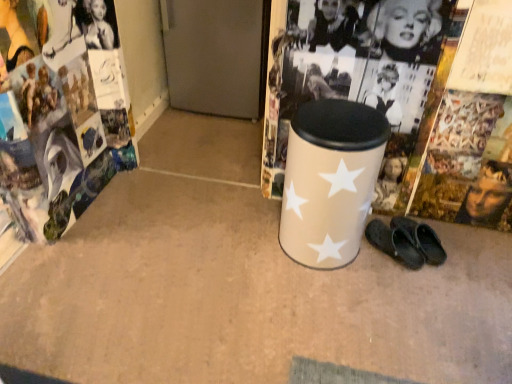
What do you see at coordinates (330, 180) in the screenshot?
I see `beige matte waste container at center` at bounding box center [330, 180].

In order to face beige matte waste container at center, should I rotate leftwards or rightwards?

You should rotate right by 9.753 degrees.

This screenshot has width=512, height=384. Describe the element at coordinates (58, 116) in the screenshot. I see `matte paper magazine at left` at that location.

You are a GUI agent. You are given a task and a screenshot of the screen. Output one action in this format:
    pyautogui.click(x=<x>, y=<y>)
    Task: Click on the beige matte waste container at center
    Image resolution: width=512 pixels, height=384 pixels.
    Given the screenshot: What is the action you would take?
    pyautogui.click(x=330, y=180)

Is matte paper magazine at left turned away from black rubber slippers at lower right?

No, matte paper magazine at left's orientation is not away from black rubber slippers at lower right.

From the image's perspective, is matte paper magazine at left above or below black rubber slippers at lower right?

matte paper magazine at left is above black rubber slippers at lower right.

Is matte paper magazine at left with black rubber slippers at lower right?

No.

Looking at this image, can you tell me how much matte paper magazine at left and black rubber slippers at lower right differ in facing direction?

The facing directions of matte paper magazine at left and black rubber slippers at lower right are 131 degrees apart.

Is beige matte waste container at center bigger than matte paper magazine at left?

Yes, beige matte waste container at center is bigger than matte paper magazine at left.

Is beige matte waste container at center placed right next to matte paper magazine at left?

They are not placed beside each other.

Is beige matte waste container at center not within matte paper magazine at left?

That's correct, beige matte waste container at center is outside of matte paper magazine at left.

From the image's perspective, does beige matte waste container at center appear higher than matte paper magazine at left?

Actually, beige matte waste container at center appears below matte paper magazine at left in the image.

Is black rubber slippers at lower right in contact with beige matte waste container at center?

No, black rubber slippers at lower right is not in contact with beige matte waste container at center.

Is black rubber slippers at lower right shorter than beige matte waste container at center?

Yes.

Is black rubber slippers at lower right positioned beyond the bounds of beige matte waste container at center?

Yes, black rubber slippers at lower right is located beyond the bounds of beige matte waste container at center.

Where is `footwear that is under the beige matte waste container at center (from a real-world perspective)`? footwear that is under the beige matte waste container at center (from a real-world perspective) is located at coordinates (407, 242).

Which is nearer, (68,207) or (316,263)?

Point (316,263)

Find the location of a particular element. This screenshot has height=384, width=512. waste container in front of the matte paper magazine at left is located at coordinates (330, 180).

Is there a large distance between matte paper magazine at left and beige matte waste container at center?

Yes, matte paper magazine at left and beige matte waste container at center are quite far apart.

In terms of width, does matte paper magazine at left look wider or thinner when compared to beige matte waste container at center?

Clearly, matte paper magazine at left has more width compared to beige matte waste container at center.

Is beige matte waste container at center taller or shorter than black rubber slippers at lower right?

Considering their sizes, beige matte waste container at center has more height than black rubber slippers at lower right.

Is point (351, 239) in front of point (411, 223)?

That is True.

Is beige matte waste container at center turned away from black rubber slippers at lower right?

No, beige matte waste container at center is not facing away from black rubber slippers at lower right.

Can you confirm if beige matte waste container at center is positioned to the right of black rubber slippers at lower right?

No.

The image size is (512, 384). I want to click on magazine above the black rubber slippers at lower right (from the image's perspective), so click(58, 116).

Could you tell me if black rubber slippers at lower right is turned towards matte paper magazine at left?

No, black rubber slippers at lower right does not turn towards matte paper magazine at left.

Does black rubber slippers at lower right have a greater height compared to matte paper magazine at left?

Correct, black rubber slippers at lower right is much taller as matte paper magazine at left.

Which object is positioned more to the right, black rubber slippers at lower right or matte paper magazine at left?

black rubber slippers at lower right is more to the right.

Find the location of a particular element. magazine below the black rubber slippers at lower right (from a real-world perspective) is located at coordinates (58, 116).

Where is `magazine lying behind the beige matte waste container at center`? The image size is (512, 384). magazine lying behind the beige matte waste container at center is located at coordinates (58, 116).

Estimate the real-world distances between objects in this image. Which object is further from matte paper magazine at left, black rubber slippers at lower right or beige matte waste container at center?

Based on the image, black rubber slippers at lower right appears to be further to matte paper magazine at left.

From the image, which object appears to be farther from black rubber slippers at lower right, matte paper magazine at left or beige matte waste container at center?

matte paper magazine at left.

Based on their spatial positions, is beige matte waste container at center or black rubber slippers at lower right further from matte paper magazine at left?

black rubber slippers at lower right.

Which object lies nearer to the anchor point beige matte waste container at center, matte paper magazine at left or black rubber slippers at lower right?

black rubber slippers at lower right is closer to beige matte waste container at center.

Considering their positions, is beige matte waste container at center positioned closer to black rubber slippers at lower right than matte paper magazine at left?

Among the two, beige matte waste container at center is located nearer to black rubber slippers at lower right.

Which object lies further to the anchor point beige matte waste container at center, black rubber slippers at lower right or matte paper magazine at left?

Based on the image, matte paper magazine at left appears to be further to beige matte waste container at center.

Locate an element on the screen. waste container between matte paper magazine at left and black rubber slippers at lower right in the horizontal direction is located at coordinates (330, 180).